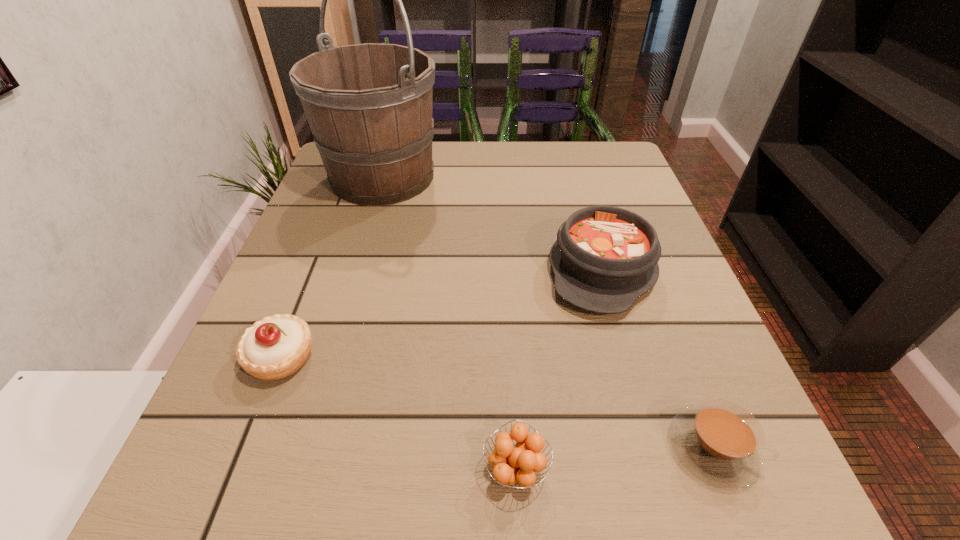
At what (x,y) coordinates should I click in order to perform the action: click on empty location between the cappuccino and the fourth nearest object. Please return your answer as a coordinate pair (x, y). Looking at the image, I should click on (657, 359).

What are the coordinates of `empty location between the cappuccino and the orange fruit` in the screenshot? It's located at (614, 459).

At what (x,y) coordinates should I click in order to perform the action: click on vacant space that's between the pastry and the second farthest object. Please return your answer as a coordinate pair (x, y). The image size is (960, 540). Looking at the image, I should click on (442, 313).

Identify the location of vacant area that lies between the pastry and the fourth nearest object. Image resolution: width=960 pixels, height=540 pixels. (442, 313).

Identify the location of empty space that is in between the third farthest object and the fourth nearest object. (442, 313).

Where is `free space between the casserole and the third object from left to right`? free space between the casserole and the third object from left to right is located at coordinates (559, 369).

Identify which object is located as the fourth nearest to the fourth nearest object. Please provide its 2D coordinates. Your answer should be formatted as a tuple, i.e. [(x, y)], where the tuple contains the x and y coordinates of a point satisfying the conditions above.

[(275, 347)]

Select which object is the closest to the pastry. Please provide its 2D coordinates. Your answer should be formatted as a tuple, i.e. [(x, y)], where the tuple contains the x and y coordinates of a point satisfying the conditions above.

[(510, 465)]